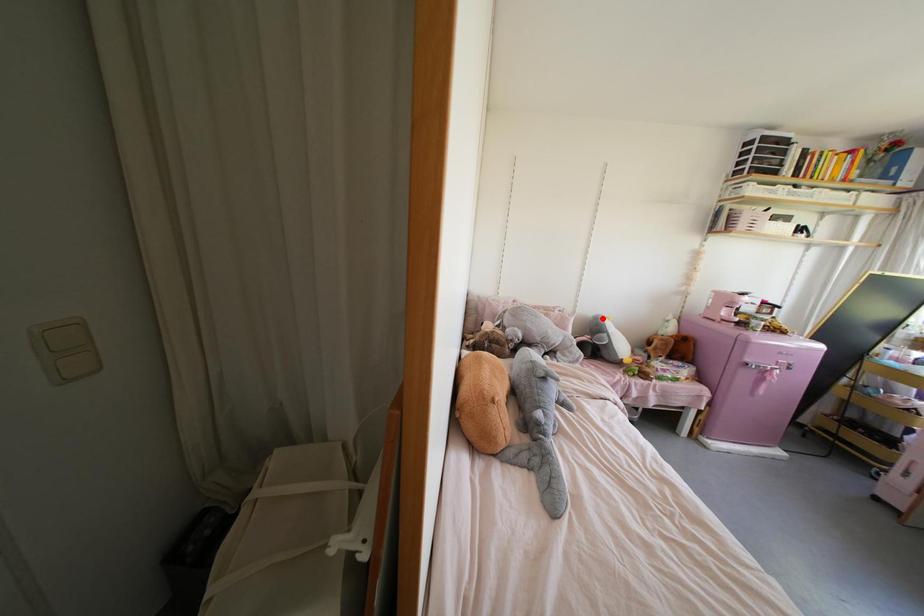
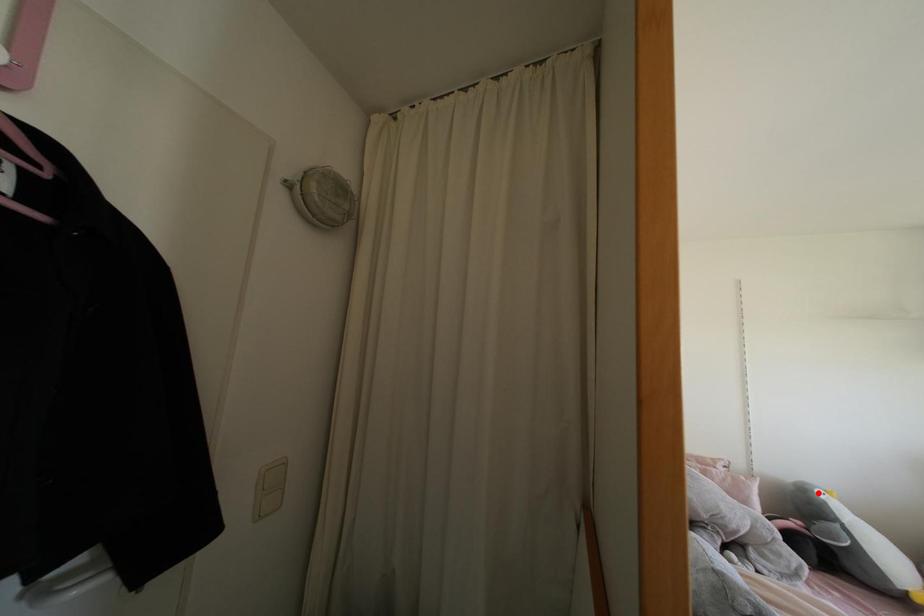
I am providing you with two images of the same scene from different viewpoints. A red point is marked on the first image and another point is marked on the second image. Are the points marked in image1 and image2 representing the same 3D position?

Yes